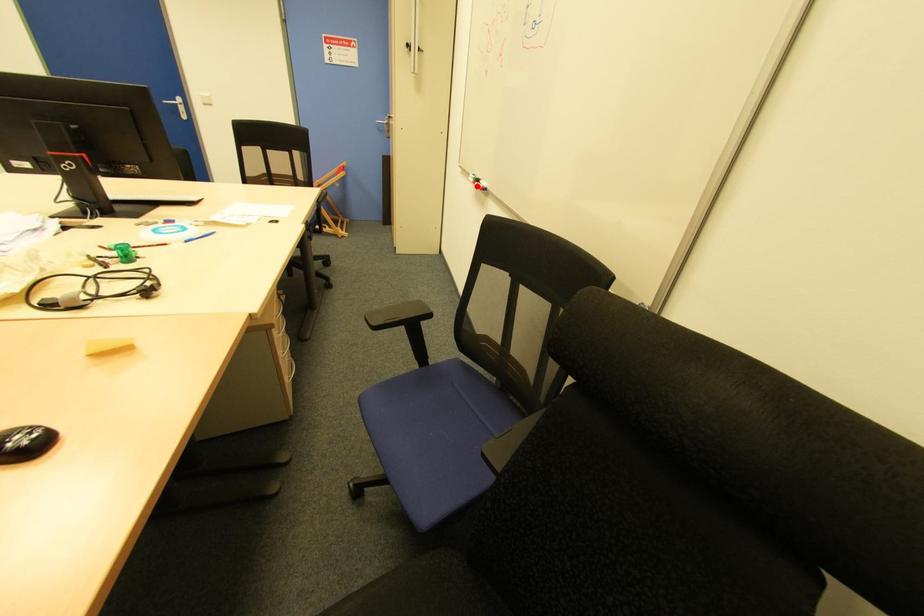
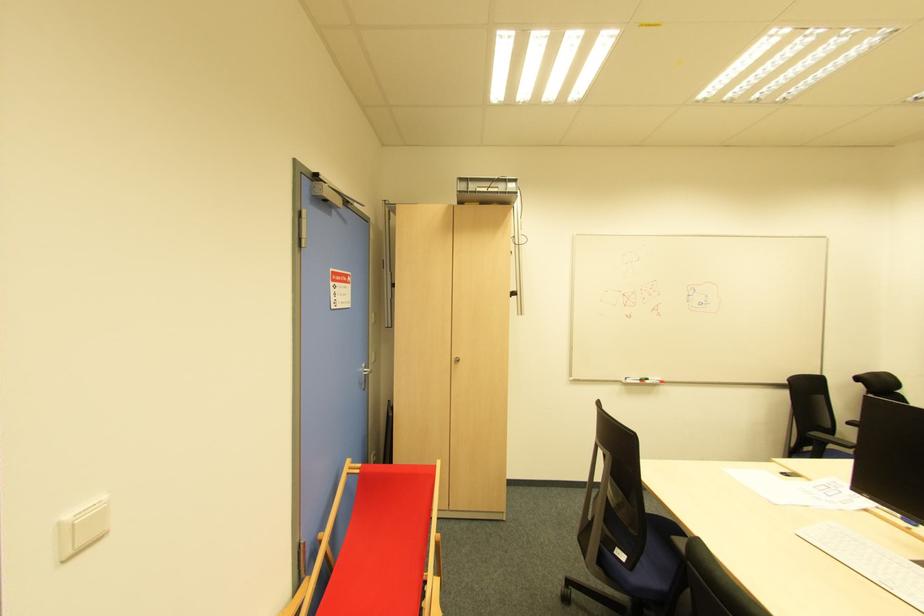
Question: I am providing you with two images of the same scene from different viewpoints. A red point is marked on the first image. At the location where the point appears in image 1, is it still visible in image 2?

Choices:
 (A) Yes
 (B) No

Answer: (A)